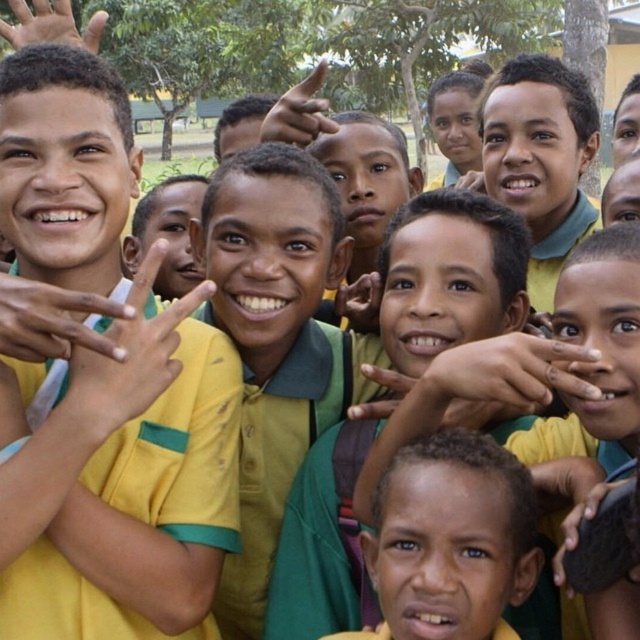
You are a photographer trying to adjust the composition of the image. You notice the matte green shirt at center and the matte yellow hand at upper center. Which object is positioned to the right of the other?

The matte green shirt at center is to the right of the matte yellow hand at upper center.

You are a photographer trying to adjust the composition of a group photo. You notice two hands in the frame, the smooth skin hand at upper left and the matte yellow hand at upper center. Given that they are 7.69 meters apart, would you consider them to be too far apart for a cohesive group shot?

The smooth skin hand at upper left and the matte yellow hand at upper center are 7.69 meters apart, which is quite a large distance. This might make them appear disconnected in the group photo, so adjusting their positions could improve the composition for a more cohesive look.